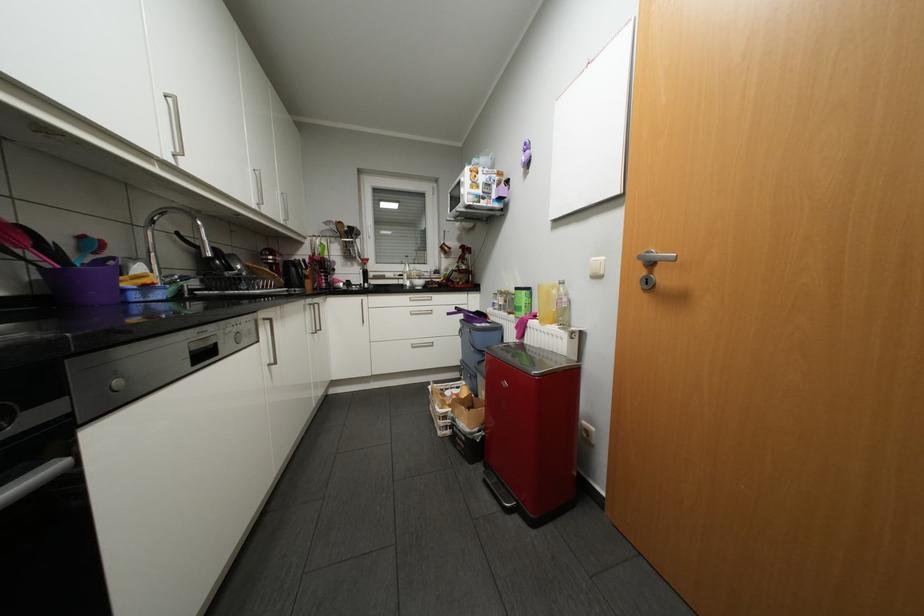
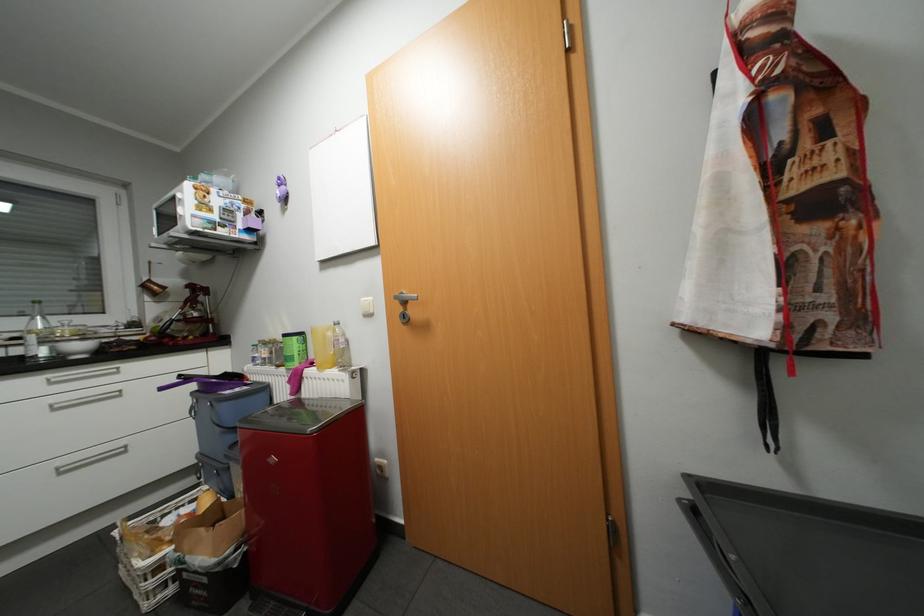
Where in the second image is the point corresponding to pixel 447 432 from the first image?

(156, 604)